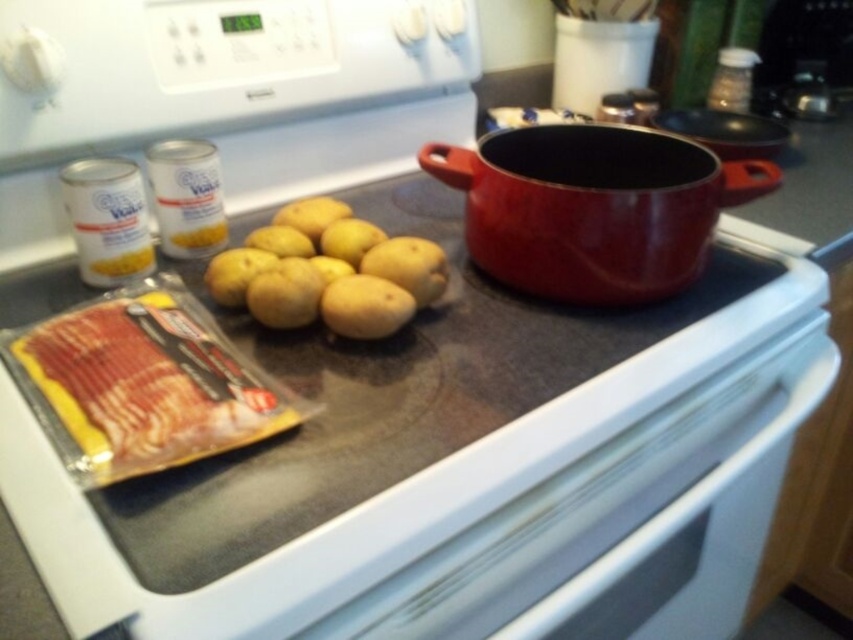
Question: Does white glossy oven at lower center have a greater width compared to yellow matte potato at center?

Choices:
 (A) yes
 (B) no

Answer: (A)

Question: Estimate the real-world distances between objects in this image. Which object is closer to the white glossy oven at lower center?

Choices:
 (A) white glossy gas stove at center
 (B) matte red pot at center
 (C) yellow matte potato at center

Answer: (A)

Question: Where is white glossy gas stove at center located in relation to matte red pot at center in the image?

Choices:
 (A) right
 (B) left

Answer: (B)

Question: Among these points, which one is farthest from the camera?

Choices:
 (A) coord(396,323)
 (B) coord(544,188)

Answer: (B)

Question: Among these points, which one is nearest to the camera?

Choices:
 (A) (779, 426)
 (B) (474, 195)
 (C) (386, 280)
 (D) (364, 420)

Answer: (D)

Question: Does white glossy gas stove at center have a larger size compared to matte red pot at center?

Choices:
 (A) no
 (B) yes

Answer: (B)